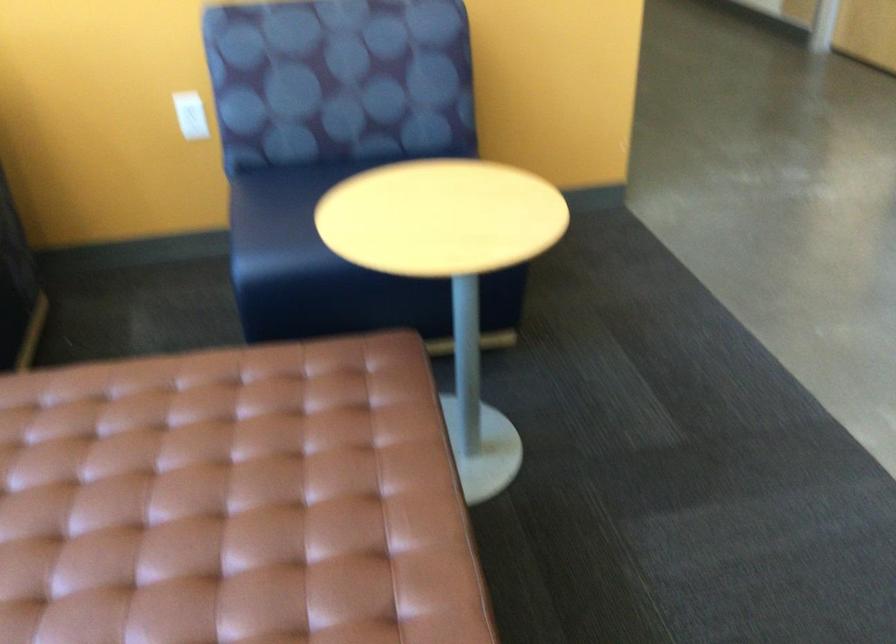
The height and width of the screenshot is (644, 896). I want to click on white light switch, so click(x=188, y=108).